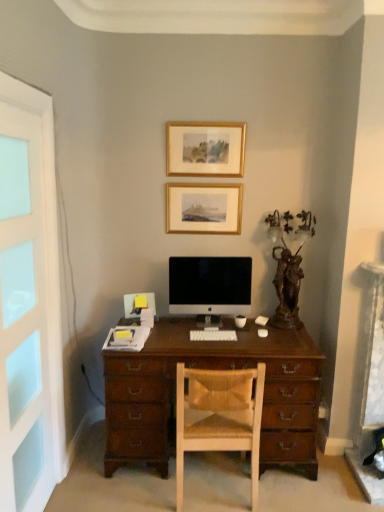
Question: Can you confirm if white frosted glass screen door at left is bigger than gold/glossy picture frame at upper center, which appears as the 1th picture frame when viewed from the top?

Choices:
 (A) no
 (B) yes

Answer: (B)

Question: Is white frosted glass screen door at left to the left of gold/glossy picture frame at upper center, which appears as the 1th picture frame when viewed from the top, from the viewer's perspective?

Choices:
 (A) yes
 (B) no

Answer: (A)

Question: Are white frosted glass screen door at left and gold/glossy picture frame at upper center, which is counted as the second picture frame, starting from the bottom, located far from each other?

Choices:
 (A) no
 (B) yes

Answer: (B)

Question: Is white frosted glass screen door at left touching gold/glossy picture frame at upper center, which appears as the 1th picture frame when viewed from the top?

Choices:
 (A) yes
 (B) no

Answer: (B)

Question: Considering the relative sizes of white frosted glass screen door at left and gold/glossy picture frame at upper center, which appears as the 1th picture frame when viewed from the top, in the image provided, is white frosted glass screen door at left wider than gold/glossy picture frame at upper center, which appears as the 1th picture frame when viewed from the top,?

Choices:
 (A) yes
 (B) no

Answer: (B)

Question: In the image, is wooden chair with woven cushion at center positioned in front of or behind satin black monitor at center?

Choices:
 (A) front
 (B) behind

Answer: (A)

Question: Which is correct: wooden chair with woven cushion at center is inside satin black monitor at center, or outside of it?

Choices:
 (A) inside
 (B) outside

Answer: (B)

Question: From the image's perspective, relative to satin black monitor at center, is wooden chair with woven cushion at center above or below?

Choices:
 (A) above
 (B) below

Answer: (B)

Question: Is point (238, 435) positioned closer to the camera than point (215, 269)?

Choices:
 (A) farther
 (B) closer

Answer: (B)

Question: Considering their positions, is white frosted glass screen door at left located in front of or behind white plastic keyboard at center?

Choices:
 (A) front
 (B) behind

Answer: (A)

Question: Does point (9, 116) appear closer or farther from the camera than point (213, 332)?

Choices:
 (A) farther
 (B) closer

Answer: (B)

Question: Considering the positions of white frosted glass screen door at left and white plastic keyboard at center in the image, is white frosted glass screen door at left bigger or smaller than white plastic keyboard at center?

Choices:
 (A) small
 (B) big

Answer: (B)

Question: Which is correct: white frosted glass screen door at left is inside white plastic keyboard at center, or outside of it?

Choices:
 (A) inside
 (B) outside

Answer: (B)

Question: Would you say white frosted glass screen door at left is inside or outside gold/glossy picture frame at upper center, which is counted as the second picture frame, starting from the bottom?

Choices:
 (A) outside
 (B) inside

Answer: (A)

Question: From the image's perspective, relative to gold/glossy picture frame at upper center, which is counted as the second picture frame, starting from the bottom, is white frosted glass screen door at left above or below?

Choices:
 (A) below
 (B) above

Answer: (A)